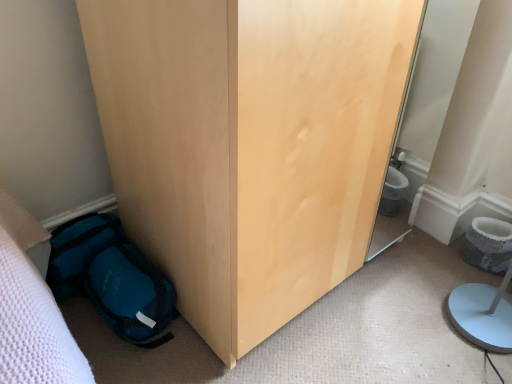
Describe the element at coordinates (249, 144) in the screenshot. I see `matte wood wardrobe at lower left` at that location.

The height and width of the screenshot is (384, 512). I want to click on teal fabric backpack at lower left, so click(112, 277).

Image resolution: width=512 pixels, height=384 pixels. I want to click on matte wood wardrobe at lower left, so click(x=249, y=144).

Is gray textured toilet bowl at lower right placed right next to teal fabric backpack at lower left?

No, gray textured toilet bowl at lower right is not touching teal fabric backpack at lower left.

Locate an element on the screen. This screenshot has width=512, height=384. toilet bowl directly beneath the teal fabric backpack at lower left (from a real-world perspective) is located at coordinates (488, 244).

Who is bigger, gray textured toilet bowl at lower right or teal fabric backpack at lower left?

teal fabric backpack at lower left is bigger.

Is gray textured toilet bowl at lower right aimed at teal fabric backpack at lower left?

No, gray textured toilet bowl at lower right is not aimed at teal fabric backpack at lower left.

From a real-world perspective, between teal fabric backpack at lower left and matte wood wardrobe at lower left, who is vertically higher?

In real-world perspective, matte wood wardrobe at lower left is above.

Between point (64, 282) and point (258, 65), which one is positioned in front?

Point (258, 65)

Is teal fabric backpack at lower left further to the viewer compared to matte wood wardrobe at lower left?

Yes, it is.

Who is smaller, teal fabric backpack at lower left or matte wood wardrobe at lower left?

teal fabric backpack at lower left.

Is matte wood wardrobe at lower left not close to teal fabric backpack at lower left?

Actually, matte wood wardrobe at lower left and teal fabric backpack at lower left are a little close together.

Considering the sizes of matte wood wardrobe at lower left and teal fabric backpack at lower left in the image, is matte wood wardrobe at lower left bigger or smaller than teal fabric backpack at lower left?

Clearly, matte wood wardrobe at lower left is larger in size than teal fabric backpack at lower left.

Does matte wood wardrobe at lower left contain teal fabric backpack at lower left?

No, teal fabric backpack at lower left is not inside matte wood wardrobe at lower left.

In the image, is matte wood wardrobe at lower left positioned in front of or behind teal fabric backpack at lower left?

matte wood wardrobe at lower left is positioned closer to the viewer than teal fabric backpack at lower left.

Between matte wood wardrobe at lower left and gray textured toilet bowl at lower right, which one has smaller width?

gray textured toilet bowl at lower right.

Does point (387, 25) appear closer or farther from the camera than point (507, 229)?

Point (387, 25) is positioned closer to the camera compared to point (507, 229).

How many degrees apart are the facing directions of matte wood wardrobe at lower left and gray textured toilet bowl at lower right?

matte wood wardrobe at lower left and gray textured toilet bowl at lower right are facing 178 degrees away from each other.

From the image's perspective, does matte wood wardrobe at lower left appear lower than gray textured toilet bowl at lower right?

Actually, matte wood wardrobe at lower left appears above gray textured toilet bowl at lower right in the image.

From a real-world perspective, is gray textured toilet bowl at lower right beneath matte wood wardrobe at lower left?

Yes.

Considering the positions of objects gray textured toilet bowl at lower right and matte wood wardrobe at lower left in the image provided, who is behind, gray textured toilet bowl at lower right or matte wood wardrobe at lower left?

Positioned behind is gray textured toilet bowl at lower right.

From a real-world perspective, which object stands above the other?

teal fabric backpack at lower left, from a real-world perspective.

Consider the image. Does teal fabric backpack at lower left appear on the right side of gray textured toilet bowl at lower right?

In fact, teal fabric backpack at lower left is to the left of gray textured toilet bowl at lower right.

Considering the sizes of objects teal fabric backpack at lower left and gray textured toilet bowl at lower right in the image provided, who is wider, teal fabric backpack at lower left or gray textured toilet bowl at lower right?

teal fabric backpack at lower left.

From the image's perspective, relative to gray textured toilet bowl at lower right, is teal fabric backpack at lower left above or below?

From the image's perspective, teal fabric backpack at lower left appears below gray textured toilet bowl at lower right.

At what (x,y) coordinates should I click in order to perform the action: click on toilet bowl below the teal fabric backpack at lower left (from a real-world perspective). Please return your answer as a coordinate pair (x, y). Looking at the image, I should click on (488, 244).

Locate an element on the screen. This screenshot has width=512, height=384. furniture lying above the teal fabric backpack at lower left (from the image's perspective) is located at coordinates (249, 144).

Considering their positions, is teal fabric backpack at lower left positioned closer to gray textured toilet bowl at lower right than matte wood wardrobe at lower left?

The object closer to gray textured toilet bowl at lower right is matte wood wardrobe at lower left.

When comparing their distances from matte wood wardrobe at lower left, does teal fabric backpack at lower left or gray textured toilet bowl at lower right seem further?

gray textured toilet bowl at lower right.

Considering their positions, is gray textured toilet bowl at lower right positioned closer to teal fabric backpack at lower left than matte wood wardrobe at lower left?

matte wood wardrobe at lower left is positioned closer to the anchor teal fabric backpack at lower left.

Which object lies further to the anchor point matte wood wardrobe at lower left, gray textured toilet bowl at lower right or teal fabric backpack at lower left?

gray textured toilet bowl at lower right lies further to matte wood wardrobe at lower left than the other object.

From the image, which object appears to be farther from teal fabric backpack at lower left, matte wood wardrobe at lower left or gray textured toilet bowl at lower right?

gray textured toilet bowl at lower right is further to teal fabric backpack at lower left.

Looking at the image, which one is located further to gray textured toilet bowl at lower right, matte wood wardrobe at lower left or teal fabric backpack at lower left?

Based on the image, teal fabric backpack at lower left appears to be further to gray textured toilet bowl at lower right.

I want to click on furniture between teal fabric backpack at lower left and gray textured toilet bowl at lower right from left to right, so click(249, 144).